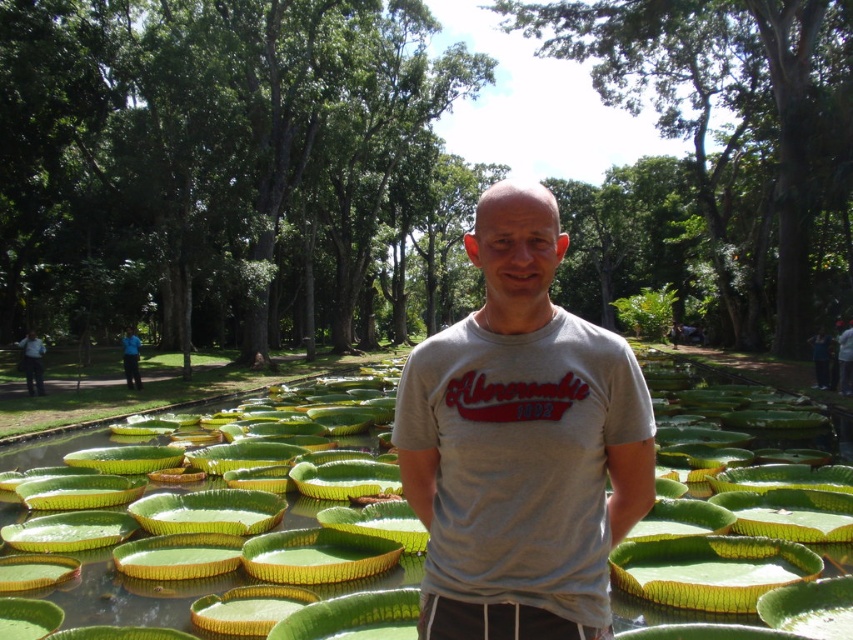
Question: Is green leafy lily pads at center wider than blue shirt at center?

Choices:
 (A) yes
 (B) no

Answer: (A)

Question: Which of these objects is positioned closest to the blue shirt at center?

Choices:
 (A) green leafy lily pads at center
 (B) blue fabric shirt at left
 (C) gray cotton t-shirt at center
 (D) green leafy plant at center

Answer: (B)

Question: Which point is farther to the camera?

Choices:
 (A) green leafy plant at center
 (B) blue fabric shirt at left

Answer: (A)

Question: Can you confirm if green leafy lily pads at center is positioned below blue shirt at center?

Choices:
 (A) yes
 (B) no

Answer: (A)

Question: Is gray cotton t-shirt at center to the right of blue shirt at center from the viewer's perspective?

Choices:
 (A) yes
 (B) no

Answer: (A)

Question: Which point is closer to the camera taking this photo?

Choices:
 (A) (614, 611)
 (B) (28, 388)
 (C) (634, 330)
 (D) (454, 582)

Answer: (D)